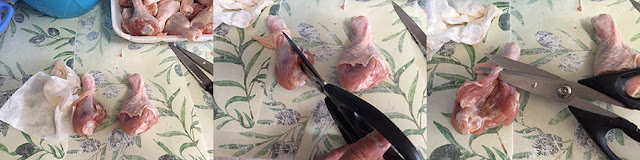
What are the coordinates of `green leaf design on tablecloth` in the screenshot? It's located at (164, 112), (230, 58), (470, 53).